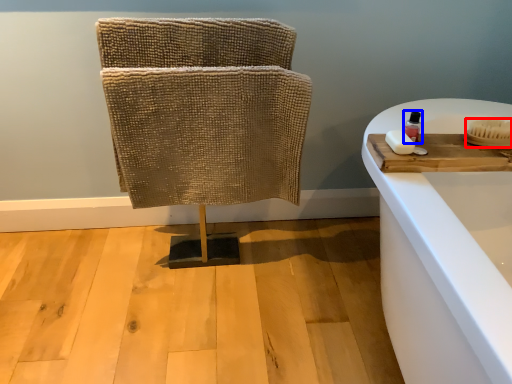
Question: Among these objects, which one is farthest to the camera, brush (highlighted by a red box) or toiletry (highlighted by a blue box)?

Choices:
 (A) brush
 (B) toiletry

Answer: (B)